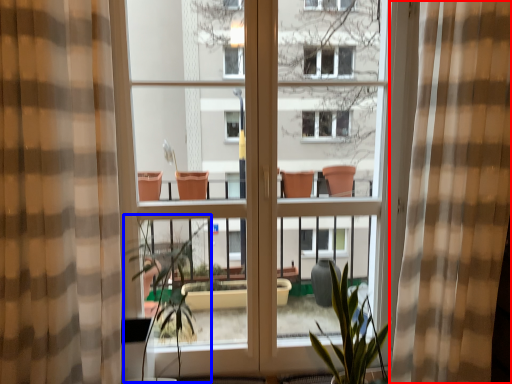
Question: Which of the following is the closest to the observer, curtain (highlighted by a red box) or vegetation (highlighted by a blue box)?

Choices:
 (A) curtain
 (B) vegetation

Answer: (A)